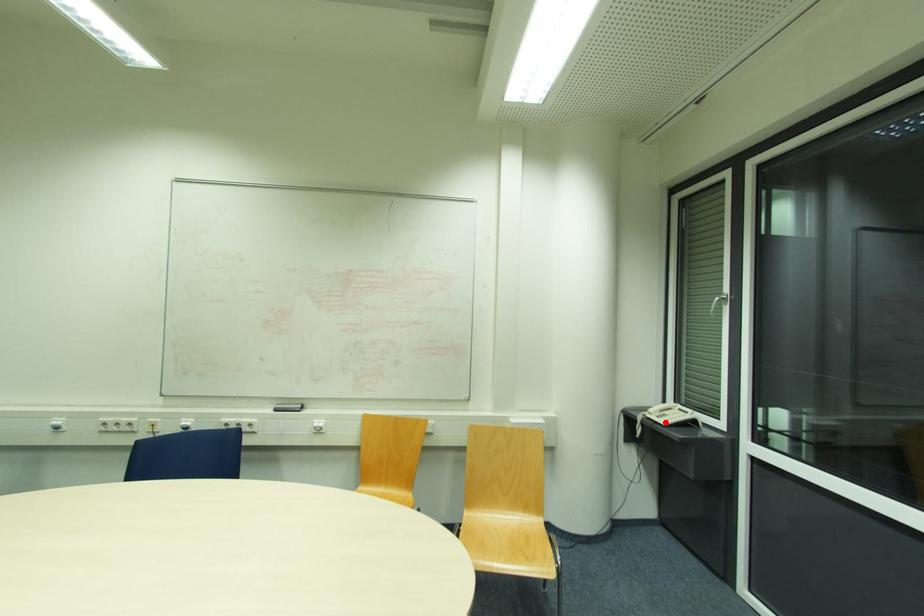
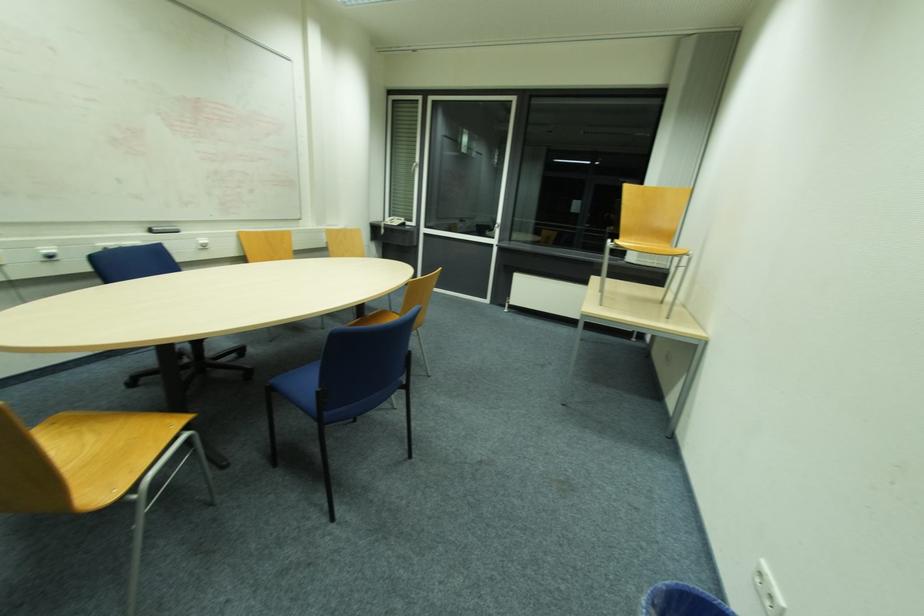
Question: I am providing you with two images of the same scene from different viewpoints. Given a red point in image1, look at the same physical point in image2. Is it:

Choices:
 (A) Closer to the viewpoint
 (B) Farther from the viewpoint

Answer: (A)